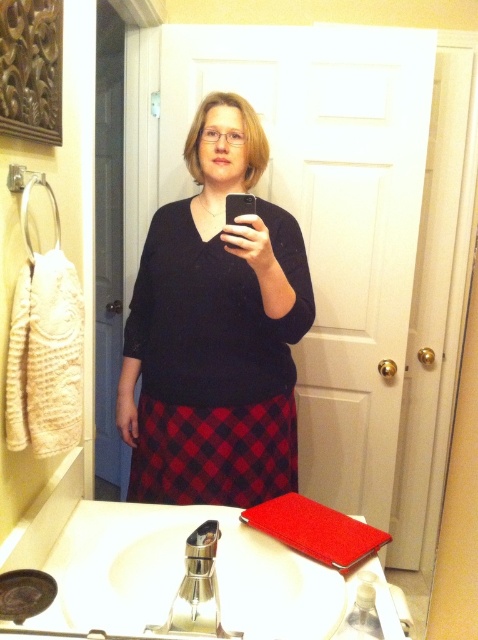
Can you confirm if polished stainless steel faucet at sink is thinner than black matte smartphone at center?

In fact, polished stainless steel faucet at sink might be wider than black matte smartphone at center.

Is polished stainless steel faucet at sink bigger than black matte smartphone at center?

Yes.

Is point (197, 529) behind point (230, 196)?

No.

Where is `polished stainless steel faucet at sink`? The width and height of the screenshot is (478, 640). polished stainless steel faucet at sink is located at coordinates (197, 589).

Does red plaid skirt at center appear over black matte smartphone at center?

No.

Between red plaid skirt at center and black matte smartphone at center, which one appears on the right side from the viewer's perspective?

black matte smartphone at center

Image resolution: width=478 pixels, height=640 pixels. Find the location of `red plaid skirt at center`. red plaid skirt at center is located at coordinates (214, 365).

Can you confirm if red plaid skirt at center is thinner than polished stainless steel faucet at sink?

No.

Can you confirm if red plaid skirt at center is positioned below polished stainless steel faucet at sink?

No.

Does point (166, 381) lie in front of point (192, 588)?

No.

In order to click on red plaid skirt at center in this screenshot , I will do `click(214, 365)`.